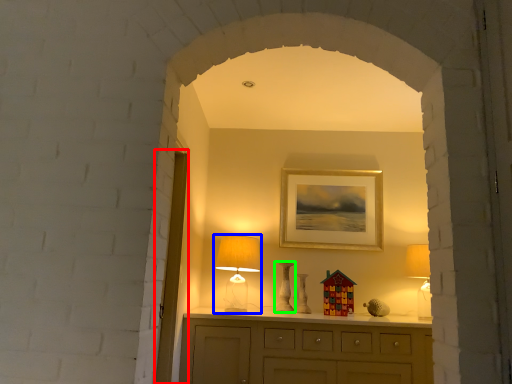
Question: Which is farther away from glass door (highlighted by a red box)? table lamp (highlighted by a blue box) or vase (highlighted by a green box)?

Choices:
 (A) table lamp
 (B) vase

Answer: (B)